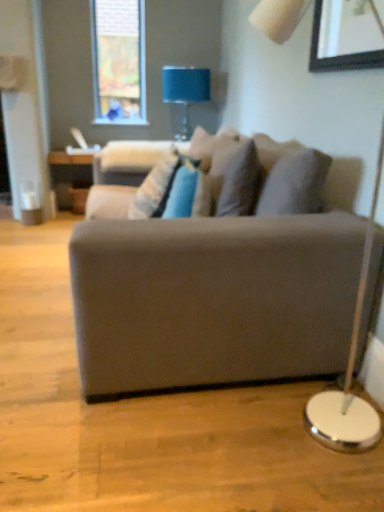
What do you see at coordinates (211, 297) in the screenshot? This screenshot has width=384, height=512. I see `suede gray couch at center` at bounding box center [211, 297].

The image size is (384, 512). Describe the element at coordinates (344, 37) in the screenshot. I see `wooden picture frame at upper right` at that location.

This screenshot has height=512, width=384. I want to click on blue fabric lampshade at upper center, so click(x=185, y=89).

This screenshot has width=384, height=512. What do you see at coordinates (127, 161) in the screenshot?
I see `velvet beige swivel chair at center` at bounding box center [127, 161].

What do you see at coordinates (155, 188) in the screenshot? I see `textured beige pillow at center` at bounding box center [155, 188].

Find the location of a particular element. suede gray couch at center is located at coordinates (211, 297).

Is velvet beige swivel chair at center a part of suede gray couch at center?

Yes, velvet beige swivel chair at center is inside suede gray couch at center.

Would you say suede gray couch at center is a long distance from velvet beige swivel chair at center?

Yes.

Based on the photo, does suede gray couch at center have a greater width compared to velvet beige swivel chair at center?

Indeed, suede gray couch at center has a greater width compared to velvet beige swivel chair at center.

From a real-world perspective, between suede gray couch at center and velvet beige swivel chair at center, who is vertically higher?

velvet beige swivel chair at center.

Based on their sizes in the image, would you say wooden picture frame at upper right is bigger or smaller than suede gray couch at center?

In the image, wooden picture frame at upper right appears to be smaller than suede gray couch at center.

Is wooden picture frame at upper right to the right of suede gray couch at center from the viewer's perspective?

Yes.

Which of these two, wooden picture frame at upper right or suede gray couch at center, stands shorter?

wooden picture frame at upper right.

Is wooden picture frame at upper right positioned with its back to suede gray couch at center?

wooden picture frame at upper right does not have its back to suede gray couch at center.

From a real-world perspective, does velvet beige swivel chair at center stand above suede gray couch at center?

Indeed, from a real-world perspective, velvet beige swivel chair at center stands above suede gray couch at center.

Could you tell me if velvet beige swivel chair at center is facing suede gray couch at center?

Yes, velvet beige swivel chair at center is turned towards suede gray couch at center.

Considering the relative sizes of velvet beige swivel chair at center and suede gray couch at center in the image provided, is velvet beige swivel chair at center shorter than suede gray couch at center?

Yes, velvet beige swivel chair at center is shorter than suede gray couch at center.

Who is bigger, textured beige pillow at center or suede gray couch at center?

Bigger between the two is suede gray couch at center.

Is textured beige pillow at center positioned with its back to suede gray couch at center?

Yes, textured beige pillow at center is positioned with its back facing suede gray couch at center.

Find the location of a particular element. This screenshot has height=512, width=384. pillow that is above the suede gray couch at center (from a real-world perspective) is located at coordinates (155, 188).

Which of these two, textured beige pillow at center or suede gray couch at center, is thinner?

textured beige pillow at center is thinner.

Can you see blue fabric lampshade at upper center touching velvet beige swivel chair at center?

blue fabric lampshade at upper center is not next to velvet beige swivel chair at center, and they're not touching.

From a real-world perspective, is blue fabric lampshade at upper center positioned above or below velvet beige swivel chair at center?

Clearly, from a real-world perspective, blue fabric lampshade at upper center is above velvet beige swivel chair at center.

Visually, is blue fabric lampshade at upper center positioned to the left or to the right of velvet beige swivel chair at center?

blue fabric lampshade at upper center is to the right of velvet beige swivel chair at center.

This screenshot has height=512, width=384. What are the coordinates of `swivel chair that appears below the blue fabric lampshade at upper center (from a real-world perspective)` in the screenshot? It's located at (127, 161).

Could velvet beige swivel chair at center be considered to be inside textured beige pillow at center?

No, velvet beige swivel chair at center is not inside textured beige pillow at center.

Which is closer, (145, 189) or (112, 168)?

Point (145, 189)

Which of these two, textured beige pillow at center or velvet beige swivel chair at center, is wider?

velvet beige swivel chair at center is wider.

From a real-world perspective, is blue fabric lampshade at upper center above or below wooden picture frame at upper right?

In terms of real-world spatial position, blue fabric lampshade at upper center is below wooden picture frame at upper right.

Can you tell me how much blue fabric lampshade at upper center and wooden picture frame at upper right differ in facing direction?

There is a 95.3-degree angle between the facing directions of blue fabric lampshade at upper center and wooden picture frame at upper right.

Looking at this image, is blue fabric lampshade at upper center positioned beyond the bounds of wooden picture frame at upper right?

Yes, blue fabric lampshade at upper center is outside of wooden picture frame at upper right.

How much distance is there between blue fabric lampshade at upper center and wooden picture frame at upper right?

A distance of 1.94 meters exists between blue fabric lampshade at upper center and wooden picture frame at upper right.

The height and width of the screenshot is (512, 384). I want to click on studio couch that appears in front of the velvet beige swivel chair at center, so click(211, 297).

Where is `studio couch below the wooden picture frame at upper right (from the image's perspective)`? The image size is (384, 512). studio couch below the wooden picture frame at upper right (from the image's perspective) is located at coordinates (211, 297).

Which object lies nearer to the anchor point textured beige pillow at center, suede gray couch at center or velvet beige swivel chair at center?

velvet beige swivel chair at center is closer to textured beige pillow at center.

From the image, which object appears to be farther from blue fabric lampshade at upper center, textured beige pillow at center or suede gray couch at center?

The object further to blue fabric lampshade at upper center is suede gray couch at center.

Based on their spatial positions, is velvet beige swivel chair at center or blue fabric lampshade at upper center closer to textured beige pillow at center?

The object closer to textured beige pillow at center is velvet beige swivel chair at center.

Estimate the real-world distances between objects in this image. Which object is further from wooden picture frame at upper right, suede gray couch at center or blue fabric lampshade at upper center?

The object further to wooden picture frame at upper right is blue fabric lampshade at upper center.

When comparing their distances from blue fabric lampshade at upper center, does wooden picture frame at upper right or textured beige pillow at center seem closer?

Based on the image, textured beige pillow at center appears to be nearer to blue fabric lampshade at upper center.

Estimate the real-world distances between objects in this image. Which object is further from suede gray couch at center, wooden picture frame at upper right or blue fabric lampshade at upper center?

Among the two, blue fabric lampshade at upper center is located further to suede gray couch at center.

Which object lies nearer to the anchor point textured beige pillow at center, suede gray couch at center or wooden picture frame at upper right?

suede gray couch at center is closer to textured beige pillow at center.

Looking at the image, which one is located closer to textured beige pillow at center, blue fabric lampshade at upper center or wooden picture frame at upper right?

wooden picture frame at upper right is positioned closer to the anchor textured beige pillow at center.

At what (x,y) coordinates should I click in order to perform the action: click on picture frame between suede gray couch at center and blue fabric lampshade at upper center in the front-back direction. Please return your answer as a coordinate pair (x, y). Looking at the image, I should click on (344, 37).

Find the location of a particular element. Image resolution: width=384 pixels, height=512 pixels. pillow between wooden picture frame at upper right and velvet beige swivel chair at center from front to back is located at coordinates (155, 188).

This screenshot has height=512, width=384. In order to click on swivel chair located between suede gray couch at center and blue fabric lampshade at upper center in the depth direction in this screenshot , I will do `click(127, 161)`.

The image size is (384, 512). I want to click on pillow located between wooden picture frame at upper right and blue fabric lampshade at upper center in the depth direction, so click(x=155, y=188).